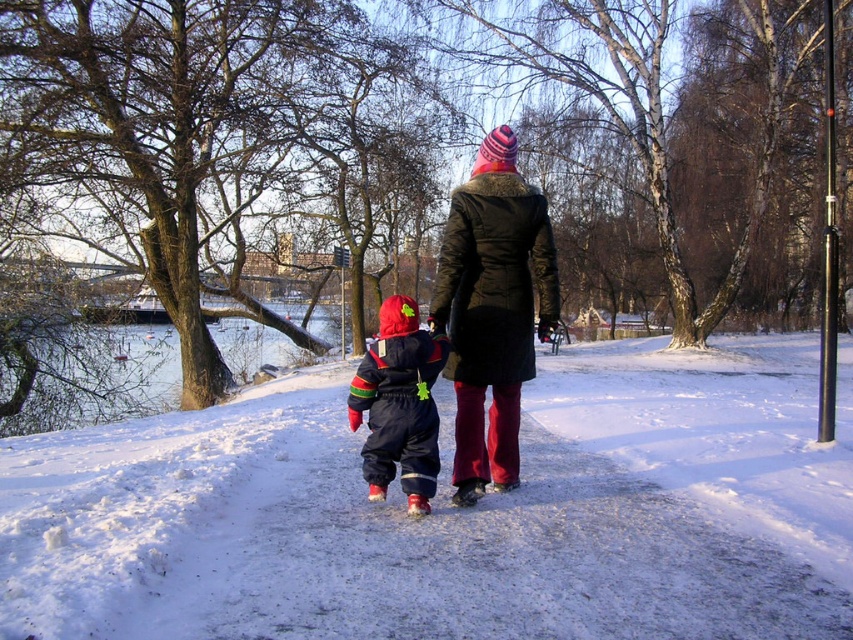
Question: Among these objects, which one is nearest to the camera?

Choices:
 (A) black wool coat at center
 (B) velvet red snowsuit at center

Answer: (B)

Question: Can you confirm if white powdery snow at center is positioned above black wool coat at center?

Choices:
 (A) yes
 (B) no

Answer: (B)

Question: Which point appears closest to the camera in this image?

Choices:
 (A) (730, 573)
 (B) (537, 326)

Answer: (A)

Question: Is white powdery snow at center below velvet red snowsuit at center?

Choices:
 (A) yes
 (B) no

Answer: (A)

Question: Among these points, which one is nearest to the camera?

Choices:
 (A) pos(486,262)
 (B) pos(659,557)
 (C) pos(430,355)

Answer: (B)

Question: Can you confirm if white powdery snow at center is smaller than black wool coat at center?

Choices:
 (A) yes
 (B) no

Answer: (B)